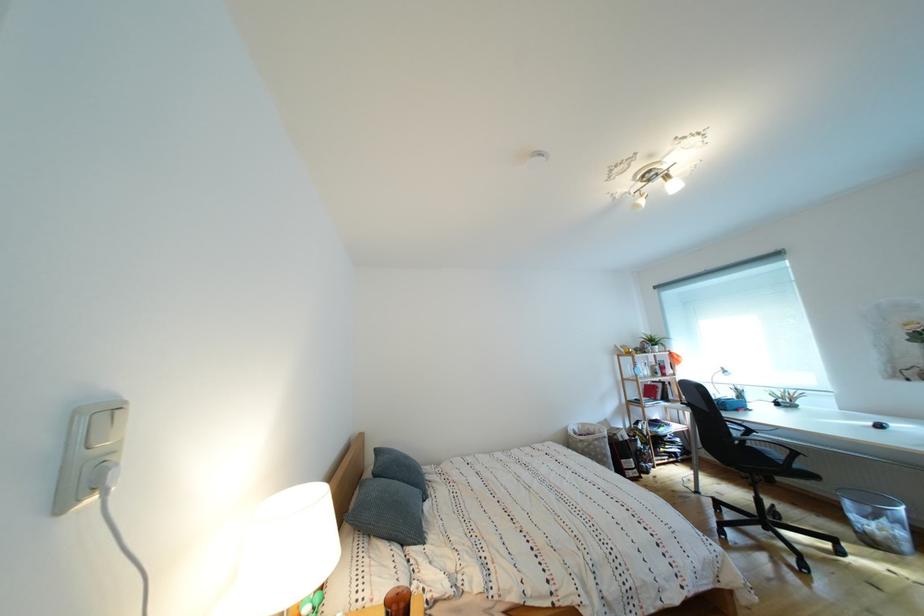
Identify the location of white light switch. (105, 426).